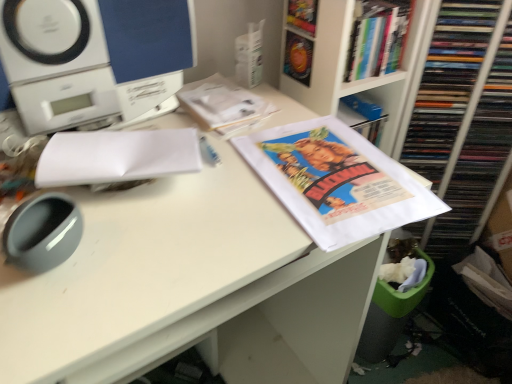
Question: Is white paper at left closer to the viewer compared to white glossy bookcase at upper right?

Choices:
 (A) no
 (B) yes

Answer: (B)

Question: Does white paper at left have a smaller size compared to white glossy bookcase at upper right?

Choices:
 (A) no
 (B) yes

Answer: (B)

Question: Can you confirm if white paper at left is taller than white glossy bookcase at upper right?

Choices:
 (A) no
 (B) yes

Answer: (A)

Question: From the image's perspective, would you say white paper at left is shown under white glossy bookcase at upper right?

Choices:
 (A) no
 (B) yes

Answer: (B)

Question: Could you tell me if white paper at left is turned towards white glossy bookcase at upper right?

Choices:
 (A) yes
 (B) no

Answer: (B)

Question: Does white paper at left have a greater width compared to white glossy bookcase at upper right?

Choices:
 (A) yes
 (B) no

Answer: (B)

Question: From a real-world perspective, is matte paper poster at center physically above white paper at upper center, marked as the 2th book in a right-to-left arrangement?

Choices:
 (A) yes
 (B) no

Answer: (B)

Question: Can you see matte paper poster at center touching white paper at upper center, which appears as the first book when ordered from the bottom?

Choices:
 (A) no
 (B) yes

Answer: (A)

Question: Is matte paper poster at center positioned with its back to white paper at upper center, which appears as the first book when ordered from the bottom?

Choices:
 (A) no
 (B) yes

Answer: (A)

Question: Considering the relative sizes of matte paper poster at center and white paper at upper center, the first book when ordered from left to right, in the image provided, is matte paper poster at center shorter than white paper at upper center, the first book when ordered from left to right,?

Choices:
 (A) yes
 (B) no

Answer: (A)

Question: Is matte paper poster at center further to camera compared to white paper at upper center, marked as the second book in a top-to-bottom arrangement?

Choices:
 (A) yes
 (B) no

Answer: (B)

Question: Is matte paper poster at center positioned before white paper at upper center, marked as the 2th book in a right-to-left arrangement?

Choices:
 (A) yes
 (B) no

Answer: (A)